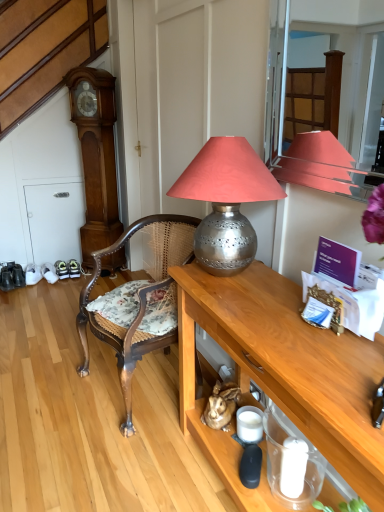
The image size is (384, 512). I want to click on vacant space underneath woven cane chair at center (from a real-world perspective), so click(x=145, y=392).